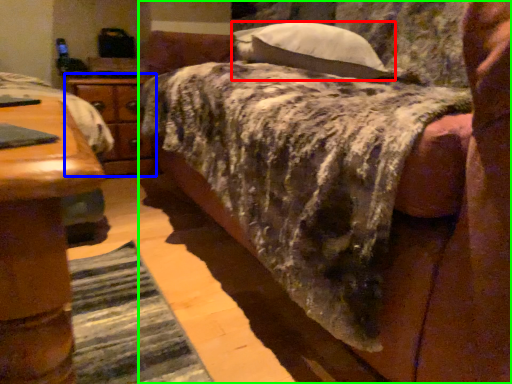
Question: Which is farther away from pillow (highlighted by a red box)? nightstand (highlighted by a blue box) or bed (highlighted by a green box)?

Choices:
 (A) nightstand
 (B) bed

Answer: (A)